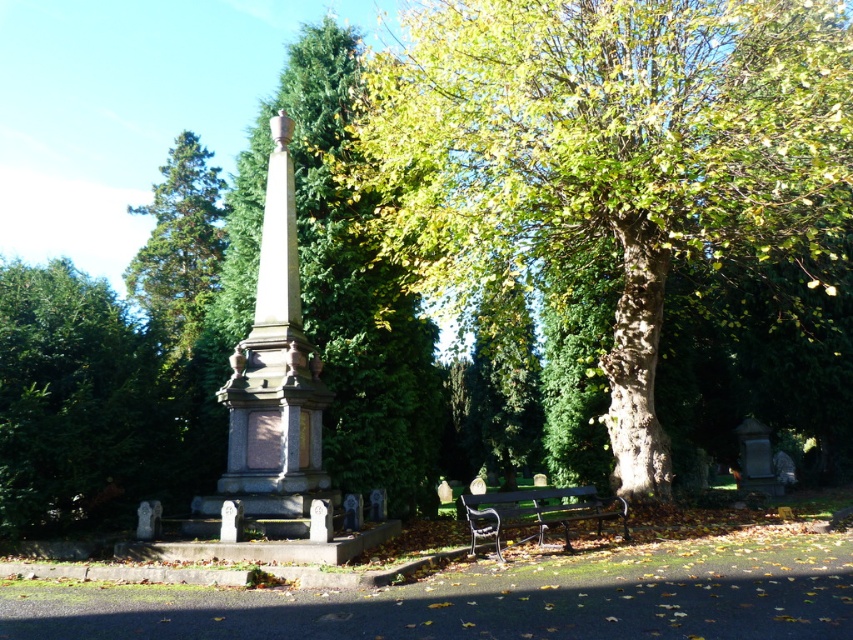
What do you see at coordinates (608, 154) in the screenshot? Image resolution: width=853 pixels, height=640 pixels. I see `green rough bark tree at center` at bounding box center [608, 154].

Is green rough bark tree at center to the right of green textured stone monument at center from the viewer's perspective?

Yes, green rough bark tree at center is to the right of green textured stone monument at center.

Between point (686, 8) and point (200, 244), which one is positioned behind?

Positioned behind is point (200, 244).

In order to click on green rough bark tree at center in this screenshot , I will do `click(608, 154)`.

Between green rough bark tree at center and green textured tree at center, which one appears on the left side from the viewer's perspective?

Positioned to the left is green textured tree at center.

Which of these two, green rough bark tree at center or green textured tree at center, stands shorter?

green rough bark tree at center is shorter.

Who is more distant from viewer, (579, 160) or (358, 253)?

Point (358, 253)

Locate an element on the screen. The image size is (853, 640). green rough bark tree at center is located at coordinates (608, 154).

Can you confirm if green textured tree at center is bigger than polished stone obelisk at center?

Actually, green textured tree at center might be smaller than polished stone obelisk at center.

Who is higher up, green textured tree at center or polished stone obelisk at center?

green textured tree at center

Where is `green textured tree at center`? This screenshot has height=640, width=853. green textured tree at center is located at coordinates (337, 289).